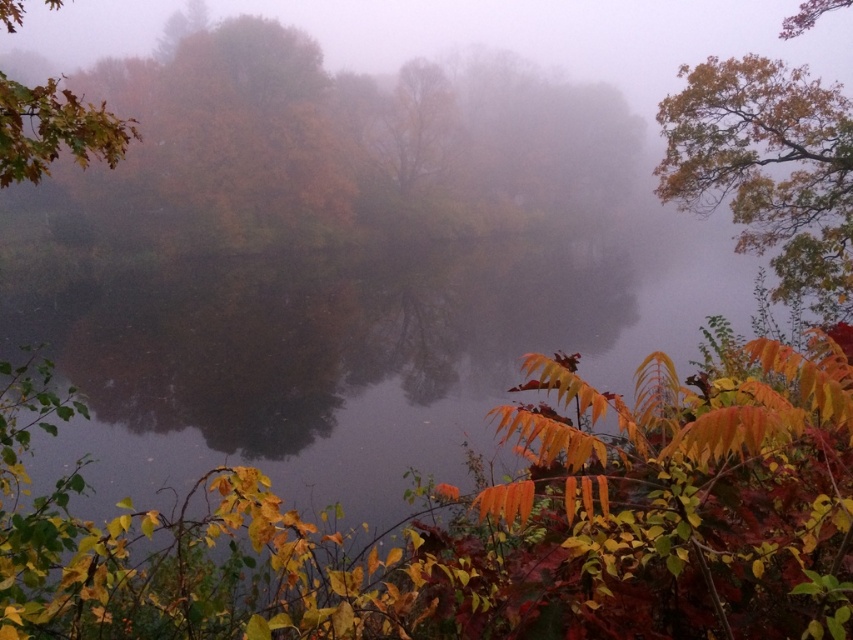
Which is above, autumn leaves at left or shiny brown leaves at upper left?

Positioned higher is autumn leaves at left.

Based on the photo, can you confirm if autumn leaves at left is positioned above shiny brown leaves at upper left?

Yes.

Based on the photo, who is more forward, (x=532, y=76) or (x=42, y=147)?

Point (x=42, y=147) is more forward.

Where is `autumn leaves at left`? The width and height of the screenshot is (853, 640). autumn leaves at left is located at coordinates (361, 140).

Is point (699, 150) positioned after point (0, 154)?

Yes, it is behind point (0, 154).

Where is `yellow-green foliage at upper right`? The image size is (853, 640). yellow-green foliage at upper right is located at coordinates (766, 168).

Does autumn leaves at left appear under yellow-green foliage at upper right?

No, autumn leaves at left is not below yellow-green foliage at upper right.

Is autumn leaves at left positioned at the back of yellow-green foliage at upper right?

Yes.

Does point (224, 141) lie behind point (666, 192)?

Yes, it is behind point (666, 192).

Locate an element on the screen. autumn leaves at left is located at coordinates tap(361, 140).